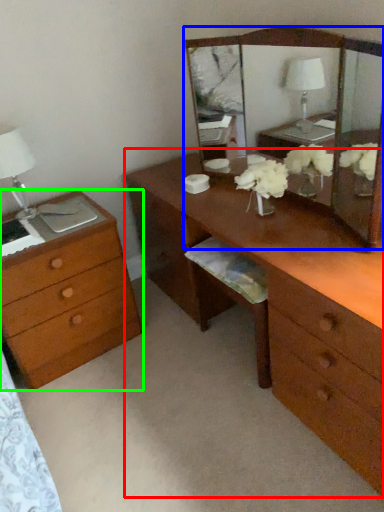
Question: Considering the real-world distances, which object is closest to desk (highlighted by a red box)? mirror (highlighted by a blue box) or chest of drawers (highlighted by a green box).

Choices:
 (A) mirror
 (B) chest of drawers

Answer: (B)